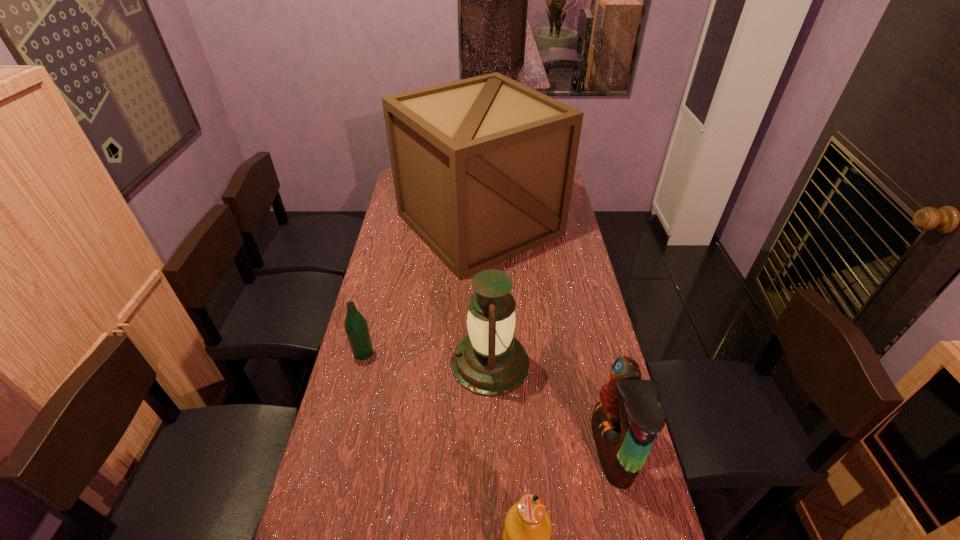
Image resolution: width=960 pixels, height=540 pixels. Identify the location of box. pos(483,168).

Locate an element on the screen. The image size is (960, 540). the farthest object is located at coordinates (483, 168).

Where is `the fourth shortest object`? The width and height of the screenshot is (960, 540). the fourth shortest object is located at coordinates (490, 361).

The width and height of the screenshot is (960, 540). What are the coordinates of `parrot` in the screenshot? It's located at (628, 418).

The height and width of the screenshot is (540, 960). Find the location of `the shortest object`. the shortest object is located at coordinates (356, 327).

Where is `free space located 0.120m on the back of the farthest object`? The width and height of the screenshot is (960, 540). free space located 0.120m on the back of the farthest object is located at coordinates (479, 171).

Locate an element on the screen. The image size is (960, 540). blank space located with the light compartment facing forward on the lantern is located at coordinates (349, 363).

Where is `free location located with the light compartment facing forward on the lantern`? This screenshot has height=540, width=960. free location located with the light compartment facing forward on the lantern is located at coordinates pyautogui.click(x=373, y=363).

Identify the location of vacant space located with the light compartment facing forward on the lantern. (373, 363).

Image resolution: width=960 pixels, height=540 pixels. I want to click on vacant space situated at the face of the parrot, so click(528, 450).